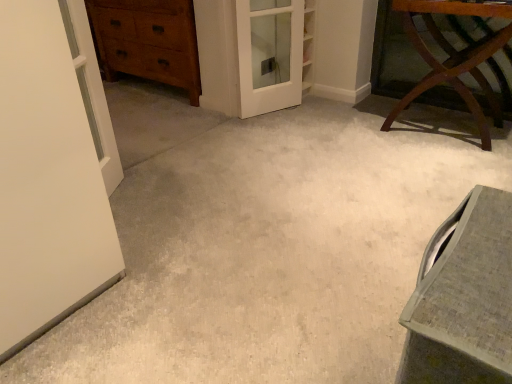
Question: Based on their positions, is white glossy door at upper left located to the left or right of matte gray vanity at lower right?

Choices:
 (A) left
 (B) right

Answer: (A)

Question: From their relative heights in the image, would you say white glossy door at upper left is taller or shorter than matte gray vanity at lower right?

Choices:
 (A) short
 (B) tall

Answer: (B)

Question: Estimate the real-world distances between objects in this image. Which object is farther from the white glossy door at upper left?

Choices:
 (A) mahogany wood table at upper right
 (B) matte gray vanity at lower right
 (C) white glass screen door at center
 (D) wooden chest of drawers at upper left

Answer: (A)

Question: Estimate the real-world distances between objects in this image. Which object is farther from the wooden chest of drawers at upper left?

Choices:
 (A) white glass screen door at center
 (B) mahogany wood table at upper right
 (C) white glossy door at upper left
 (D) matte gray vanity at lower right

Answer: (D)